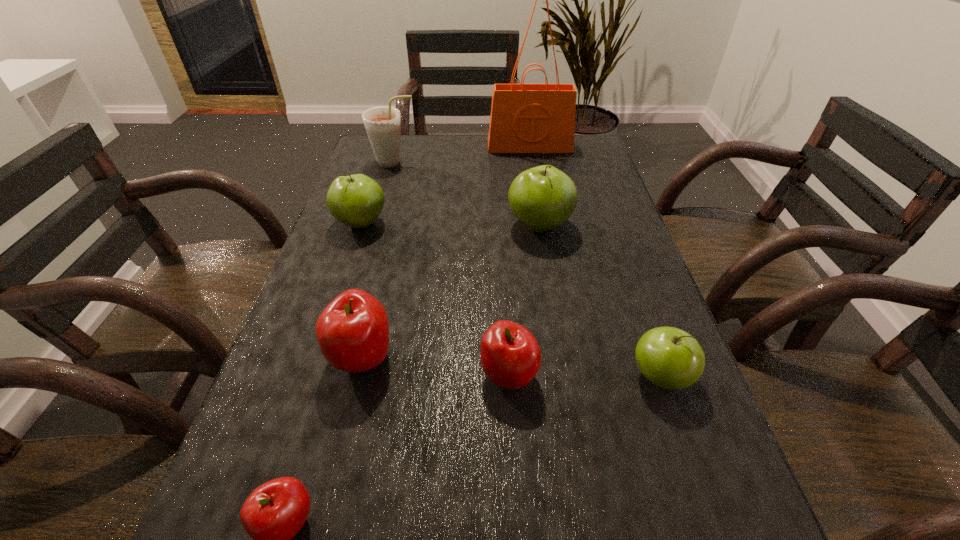
Select which object appears as the second closest to the tallest apple. Please provide its 2D coordinates. Your answer should be formatted as a tuple, i.e. [(x, y)], where the tuple contains the x and y coordinates of a point satisfying the conditions above.

[(525, 118)]

Where is `object that is the sixth nearest to the farthest object`? Image resolution: width=960 pixels, height=540 pixels. object that is the sixth nearest to the farthest object is located at coordinates (510, 355).

Locate an element on the screen. This screenshot has height=540, width=960. apple identified as the second closest to the nearest green apple is located at coordinates coord(542,198).

This screenshot has width=960, height=540. Identify the location of apple that is the third nearest to the shortest object. (668, 357).

Identify the location of green apple that is the third closest to the rightmost red apple. Image resolution: width=960 pixels, height=540 pixels. (357, 200).

Locate which green apple is the second closest to the farthest object. Please provide its 2D coordinates. Your answer should be formatted as a tuple, i.e. [(x, y)], where the tuple contains the x and y coordinates of a point satisfying the conditions above.

[(357, 200)]

Identify which red apple is the closest to the smallest red apple. Please provide its 2D coordinates. Your answer should be formatted as a tuple, i.e. [(x, y)], where the tuple contains the x and y coordinates of a point satisfying the conditions above.

[(352, 331)]

Where is `red apple that is the third closest to the second smallest green apple`? red apple that is the third closest to the second smallest green apple is located at coordinates (274, 512).

The height and width of the screenshot is (540, 960). I want to click on free spot that satisfies the following two spatial constraints: 1. on the drink side of the biggest red apple; 2. on the left side of the root beer, so click(x=338, y=357).

The height and width of the screenshot is (540, 960). In order to click on free spot that satisfies the following two spatial constraints: 1. on the logo side of the tote bag; 2. on the drink side of the seventh nearest object in this screenshot , I will do `click(533, 163)`.